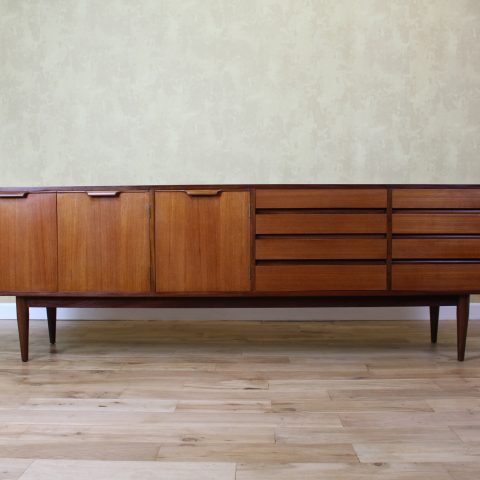
Locate an element on the screen. This screenshot has height=480, width=480. wooden rectangular drawers is located at coordinates coord(328,197), coord(329,221), coord(327,245), coord(328,276), coord(445,200), coord(446,224), coord(445,248), coord(444,276).